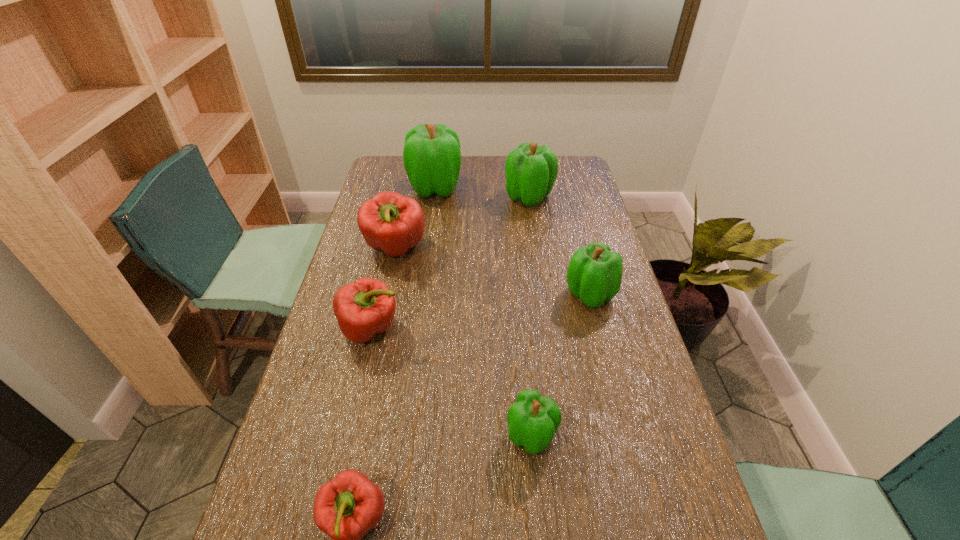
Where is `the leftmost green bell pepper`? the leftmost green bell pepper is located at coordinates (432, 158).

Locate an element on the screen. The image size is (960, 540). the biggest green bell pepper is located at coordinates tap(432, 158).

Identify the location of the third smallest green bell pepper. Image resolution: width=960 pixels, height=540 pixels. (531, 170).

Where is `the fifth nearest object`? the fifth nearest object is located at coordinates (390, 222).

Find the location of a particular element. The image size is (960, 540). the farthest pink bell pepper is located at coordinates (390, 222).

You are a GUI agent. You are given a task and a screenshot of the screen. Output one action in this format:
    pyautogui.click(x=<x>, y=<y>)
    Task: Click on the second nearest green bell pepper
    The image size is (960, 540).
    Given the screenshot: What is the action you would take?
    pyautogui.click(x=594, y=274)

Where is `the second farthest pink bell pepper`? This screenshot has height=540, width=960. the second farthest pink bell pepper is located at coordinates (366, 307).

This screenshot has height=540, width=960. Identify the location of the nearest green bell pepper. (533, 420).

Identify the location of the sixth farthest bell pepper. (533, 420).

I want to click on vacant area situated on the right of the biggest green bell pepper, so click(542, 188).